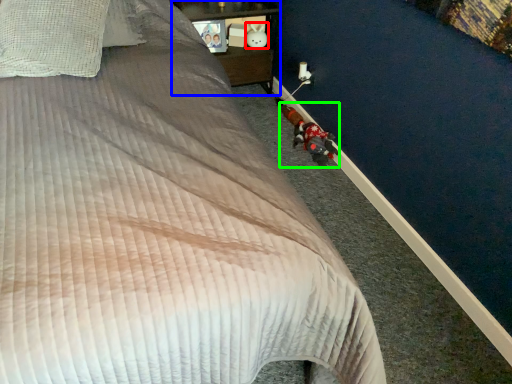
Question: Which object is the closest to the toy (highlighted by a red box)? Choose among these: furniture (highlighted by a blue box) or toy (highlighted by a green box).

Choices:
 (A) furniture
 (B) toy

Answer: (A)